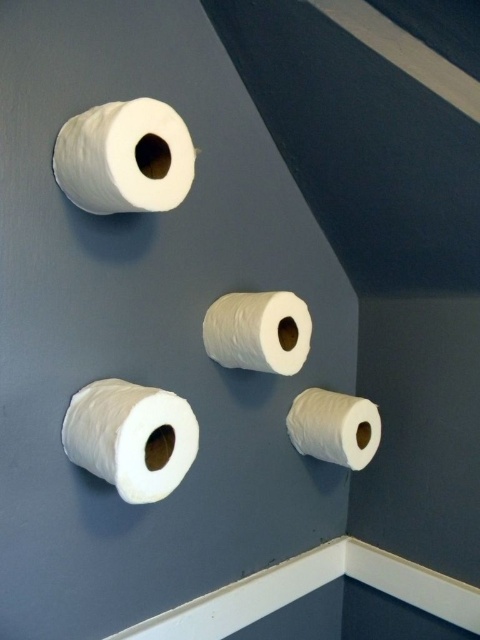
Question: Which of the following is the farthest from the observer?

Choices:
 (A) (274, 320)
 (B) (95, 147)

Answer: (A)

Question: Can you confirm if white matte paper towel at upper left is positioned to the right of white matte toilet paper at lower left?

Choices:
 (A) no
 (B) yes

Answer: (A)

Question: Which point appears farthest from the camera in this image?

Choices:
 (A) (101, 196)
 (B) (286, 353)

Answer: (B)

Question: In this image, where is white matte paper towel at upper left located relative to white matte toilet paper at lower right?

Choices:
 (A) below
 (B) above

Answer: (B)

Question: Does white matte toilet paper at lower left appear under white matte paper towel at center?

Choices:
 (A) yes
 (B) no

Answer: (A)

Question: Which object is closer to the camera taking this photo?

Choices:
 (A) white matte toilet paper at lower right
 (B) white matte paper towel at upper left

Answer: (B)